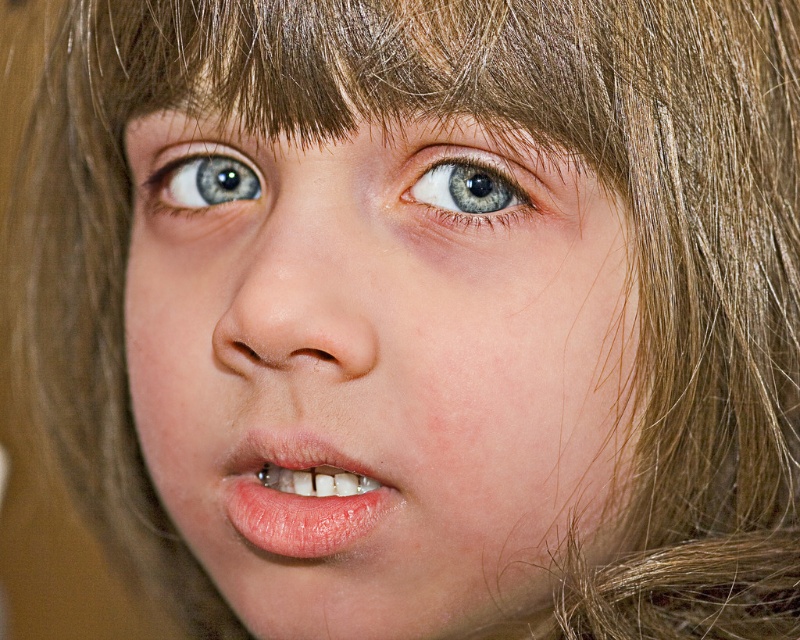
Question: Does pink glossy lips at center have a lesser width compared to blue glossy eye at upper left?

Choices:
 (A) yes
 (B) no

Answer: (B)

Question: Does pink glossy lips at center have a lesser width compared to blue glossy eye at center?

Choices:
 (A) no
 (B) yes

Answer: (A)

Question: Which point is farther to the camera?

Choices:
 (A) pink glossy lips at center
 (B) smooth skin face at center
 (C) blue glossy eye at center

Answer: (A)

Question: Is smooth skin face at center positioned in front of blue glossy eye at center?

Choices:
 (A) yes
 (B) no

Answer: (A)

Question: Which point appears closest to the camera in this image?

Choices:
 (A) (280, 449)
 (B) (298, 506)
 (C) (445, 172)
 (D) (169, 179)

Answer: (C)

Question: Which point is farther to the camera?

Choices:
 (A) smooth skin face at center
 (B) pink glossy lips at center
 (C) blue glossy eye at upper left

Answer: (C)